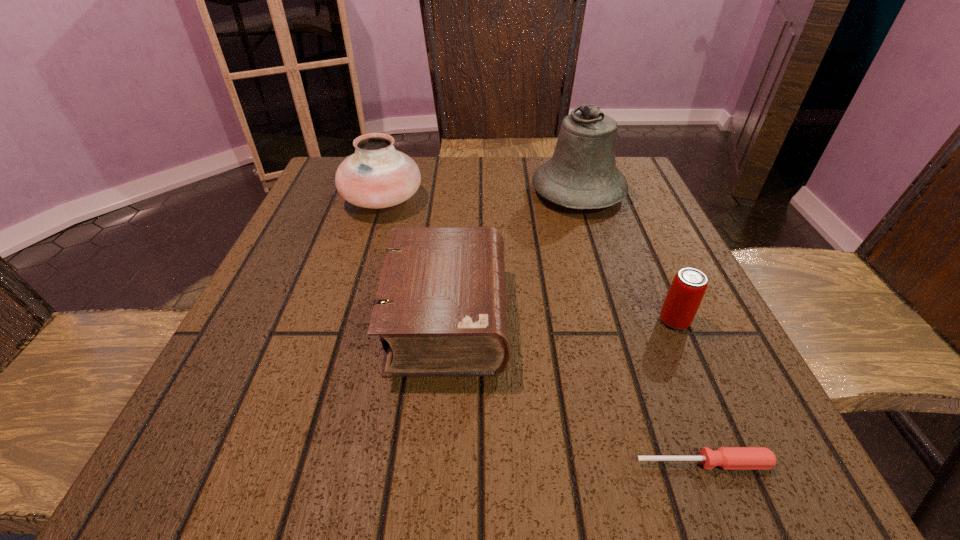
Locate an element on the screen. This screenshot has height=540, width=960. free space between the second tallest object and the tallest object is located at coordinates (480, 196).

I want to click on free space between the beer can and the screwdriver, so click(689, 392).

You are a GUI agent. You are given a task and a screenshot of the screen. Output one action in this format:
    pyautogui.click(x=<x>, y=<y>)
    Task: Click on the free space between the beer can and the bell
    This screenshot has height=540, width=960.
    Given the screenshot: What is the action you would take?
    pyautogui.click(x=626, y=256)

Find the location of a particular element. The width and height of the screenshot is (960, 540). free space between the fourth shortest object and the beer can is located at coordinates (528, 260).

You are a GUI agent. You are given a task and a screenshot of the screen. Output one action in this format:
    pyautogui.click(x=<x>, y=<y>)
    Task: Click on the free space between the beer can and the Bible
    The height and width of the screenshot is (540, 960).
    Given the screenshot: What is the action you would take?
    pyautogui.click(x=561, y=319)

The image size is (960, 540). Identify the location of vacant region between the bell and the pottery. (480, 196).

Locate an element on the screen. The height and width of the screenshot is (540, 960). free spot between the pottery and the beer can is located at coordinates (528, 260).

Where is `free space between the beer can and the nearest object`? free space between the beer can and the nearest object is located at coordinates (689, 392).

This screenshot has width=960, height=540. Identify the location of vacant point located between the beer can and the bell. (626, 256).

Choose which object is the fourth nearest neighbor to the second tallest object. Please provide its 2D coordinates. Your answer should be formatted as a tuple, i.e. [(x, y)], where the tuple contains the x and y coordinates of a point satisfying the conditions above.

[(728, 458)]